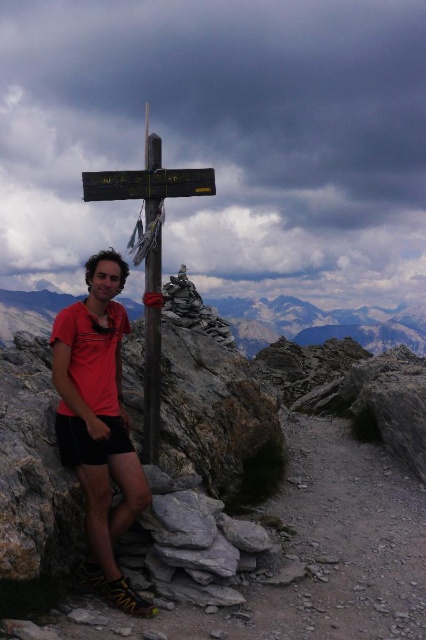
Who is positioned more to the left, matte red shirt at center or rocky mountain at center?

Positioned to the left is matte red shirt at center.

What do you see at coordinates (98, 419) in the screenshot? I see `matte red shirt at center` at bounding box center [98, 419].

Does point (112, 518) lie in front of point (131, 312)?

Yes, point (112, 518) is in front of point (131, 312).

Where is `matte red shirt at center`? This screenshot has height=640, width=426. matte red shirt at center is located at coordinates (98, 419).

Can you confirm if matte red shirt at center is positioned to the right of wooden pole at center?

In fact, matte red shirt at center is to the left of wooden pole at center.

Which is behind, point (134, 516) or point (158, 456)?

Positioned behind is point (158, 456).

Find the location of a particular element. matte red shirt at center is located at coordinates (98, 419).

Can you confirm if matte red shirt at center is bigger than wooden sign at center?

Actually, matte red shirt at center might be smaller than wooden sign at center.

Identify the location of matte red shirt at center. [98, 419].